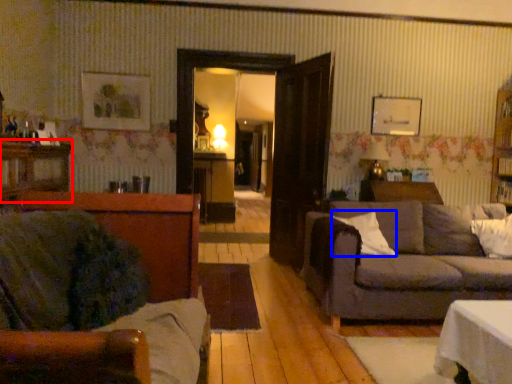
Question: Which object appears farthest to the camera in this image, dresser (highlighted by a red box) or pillow (highlighted by a blue box)?

Choices:
 (A) dresser
 (B) pillow

Answer: (B)